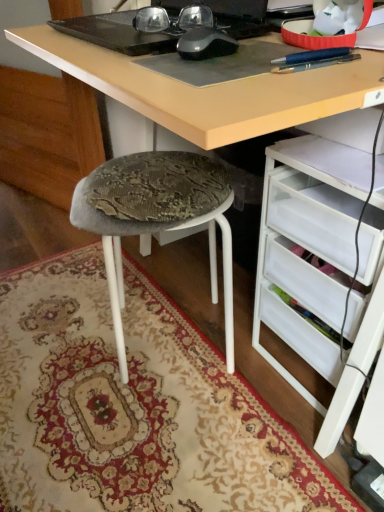
I want to click on vacant area in front of black matte mouse at center, so click(213, 69).